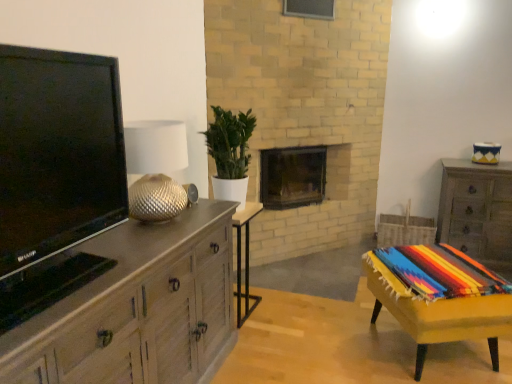
Question: Considering the relative sizes of wooden chest of drawers at right, the second chest of drawers positioned from the front, and gold textured lampshade at left in the image provided, is wooden chest of drawers at right, the second chest of drawers positioned from the front, shorter than gold textured lampshade at left?

Choices:
 (A) no
 (B) yes

Answer: (A)

Question: Can you confirm if wooden chest of drawers at right, which is the first chest of drawers from right to left, is thinner than gold textured lampshade at left?

Choices:
 (A) no
 (B) yes

Answer: (A)

Question: Is wooden chest of drawers at right, which is the first chest of drawers from right to left, at the right side of gold textured lampshade at left?

Choices:
 (A) no
 (B) yes

Answer: (B)

Question: From the image's perspective, is wooden chest of drawers at right, positioned as the 1th chest of drawers in back-to-front order, on gold textured lampshade at left?

Choices:
 (A) yes
 (B) no

Answer: (B)

Question: From a real-world perspective, is wooden chest of drawers at right, positioned as the 1th chest of drawers in back-to-front order, under gold textured lampshade at left?

Choices:
 (A) no
 (B) yes

Answer: (B)

Question: Could gold textured lampshade at left be considered to be inside wooden chest of drawers at right, positioned as the 1th chest of drawers in back-to-front order?

Choices:
 (A) no
 (B) yes

Answer: (A)

Question: Is wooden side table at center, the first table from the left, positioned far away from wooden chest of drawers at right, which is the first chest of drawers from right to left?

Choices:
 (A) yes
 (B) no

Answer: (A)

Question: Is wooden side table at center, the first table from the left, aimed at wooden chest of drawers at right, the second chest of drawers positioned from the front?

Choices:
 (A) yes
 (B) no

Answer: (B)

Question: Considering the relative positions of wooden side table at center, the first table from the left, and wooden chest of drawers at right, the second chest of drawers positioned from the front, in the image provided, is wooden side table at center, the first table from the left, behind wooden chest of drawers at right, the second chest of drawers positioned from the front,?

Choices:
 (A) yes
 (B) no

Answer: (B)

Question: Is wooden side table at center, which is the second table from right to left, next to wooden chest of drawers at right, the second chest of drawers positioned from the front, and touching it?

Choices:
 (A) yes
 (B) no

Answer: (B)

Question: Is wooden side table at center, which is the second table from right to left, wider than wooden chest of drawers at right, positioned as the 1th chest of drawers in back-to-front order?

Choices:
 (A) no
 (B) yes

Answer: (A)

Question: Is wooden side table at center, which is the second table from right to left, smaller than wooden chest of drawers at right, positioned as the 1th chest of drawers in back-to-front order?

Choices:
 (A) yes
 (B) no

Answer: (A)

Question: Considering the relative positions of dark brown wood fireplace at center and yellow fabric-covered table at lower right, the first table viewed from the right, in the image provided, is dark brown wood fireplace at center in front of yellow fabric-covered table at lower right, the first table viewed from the right,?

Choices:
 (A) no
 (B) yes

Answer: (A)